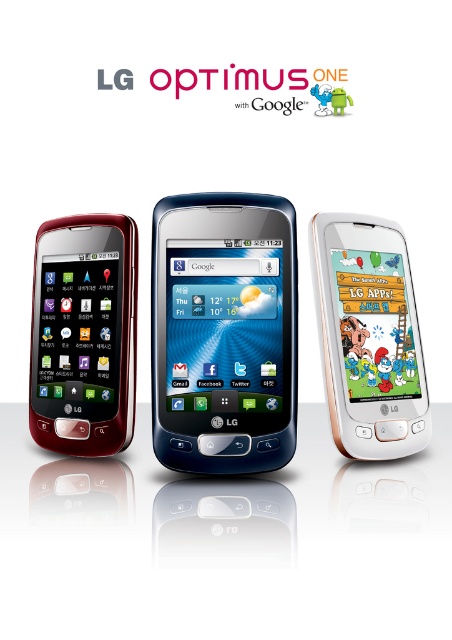
Does matte black phone at left have a greater width compared to white glossy smartphone at right?

Incorrect, matte black phone at left's width does not surpass white glossy smartphone at right's.

Does matte black phone at left have a larger size compared to white glossy smartphone at right?

Actually, matte black phone at left might be smaller than white glossy smartphone at right.

What are the coordinates of `matte black phone at left` in the screenshot? It's located at (84, 333).

Which is above, metallic blue lg optimus one at center or matte black phone at left?

metallic blue lg optimus one at center is higher up.

Is metallic blue lg optimus one at center to the right of matte black phone at left from the viewer's perspective?

Indeed, metallic blue lg optimus one at center is positioned on the right side of matte black phone at left.

Who is more distant from viewer, [249,449] or [116,372]?

Point [116,372]

Find the location of a particular element. Image resolution: width=452 pixels, height=640 pixels. metallic blue lg optimus one at center is located at coordinates (224, 332).

Does metallic blue lg optimus one at center have a greater width compared to white glossy smartphone at right?

Yes, metallic blue lg optimus one at center is wider than white glossy smartphone at right.

Identify the location of metallic blue lg optimus one at center. This screenshot has height=640, width=452. (224, 332).

What are the coordinates of `metallic blue lg optimus one at center` in the screenshot? It's located at (224, 332).